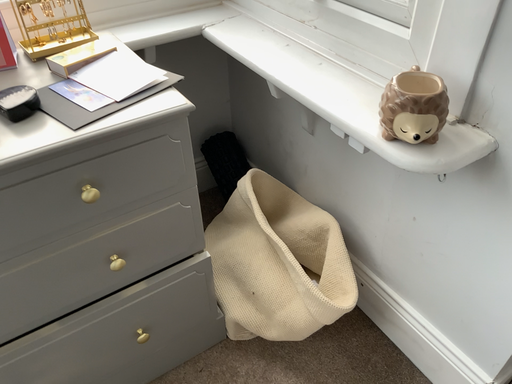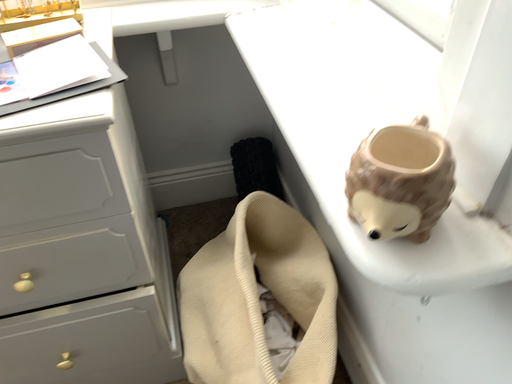
Question: Which way did the camera rotate in the video?

Choices:
 (A) rotated left
 (B) rotated right

Answer: (A)